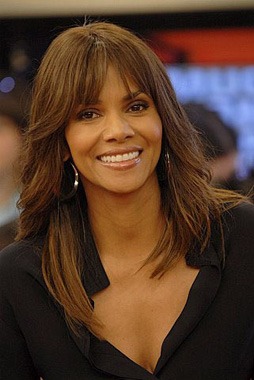
The width and height of the screenshot is (254, 380). Find the location of `chest`. chest is located at coordinates (181, 298).